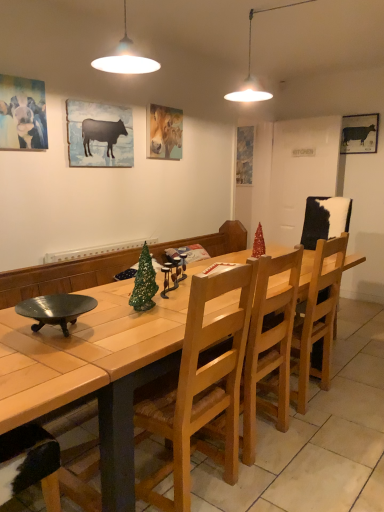
You are a GUI agent. You are given a task and a screenshot of the screen. Output one action in this format:
    pyautogui.click(x=<x>, y=<y>)
    Task: Click on the free space in front of wooden chair at center, which is counted as the 2th chair, starting from the front
    Image resolution: width=384 pixels, height=512 pixels.
    Given the screenshot: What is the action you would take?
    pyautogui.click(x=316, y=433)